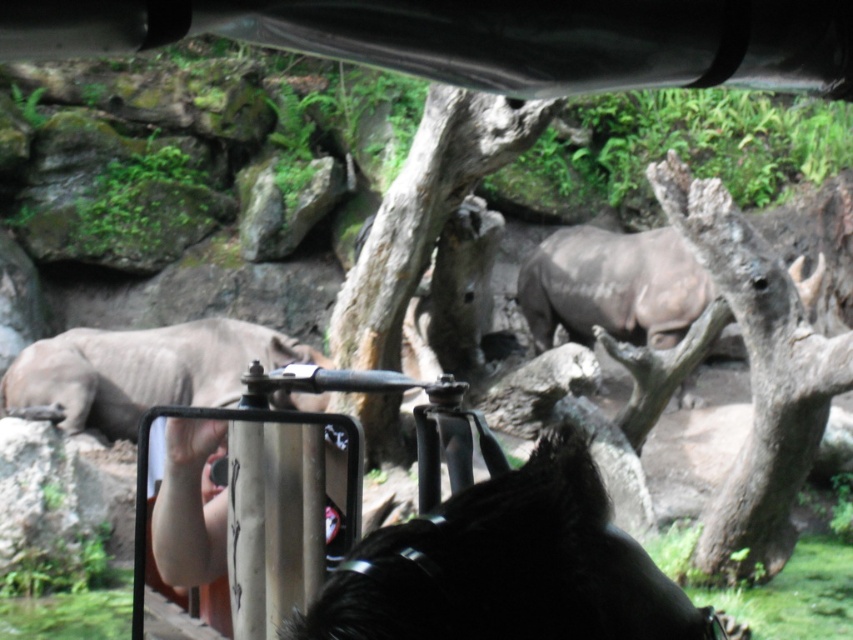
Find the location of a particular element. This screenshot has width=853, height=640. black matte hair at center is located at coordinates (508, 566).

Consider the image. Between black matte hair at center and gray matte rhinoceros at center, which one is positioned lower?

black matte hair at center is lower down.

Where is `black matte hair at center`? The image size is (853, 640). black matte hair at center is located at coordinates (508, 566).

Who is lower down, black matte hair at center or smooth brown tree trunk at center?

black matte hair at center is below.

Which is more to the right, black matte hair at center or smooth brown tree trunk at center?

black matte hair at center is more to the right.

Which is behind, point (395, 554) or point (496, 147)?

Point (496, 147)

Locate an element on the screen. The image size is (853, 640). black matte hair at center is located at coordinates (508, 566).

Can you confirm if smooth brown tree trunk at center is smaller than gray matte rhinoceros at left?

Actually, smooth brown tree trunk at center might be larger than gray matte rhinoceros at left.

Does point (428, 189) come closer to viewer compared to point (181, 365)?

That is True.

Image resolution: width=853 pixels, height=640 pixels. Find the location of `smooth brown tree trunk at center`. smooth brown tree trunk at center is located at coordinates (x=424, y=211).